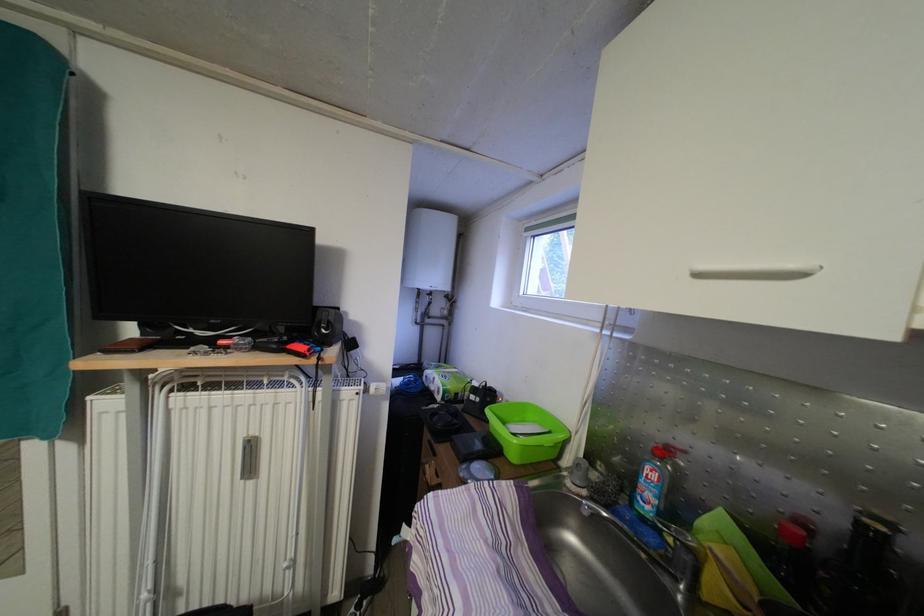
Find where to push the silver faucet handle. Please return your answer as a coordinate pair (x, y).

(611, 523)